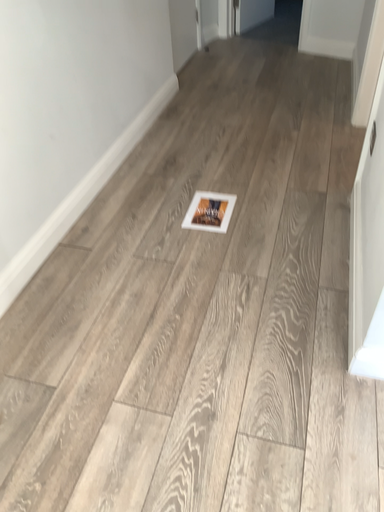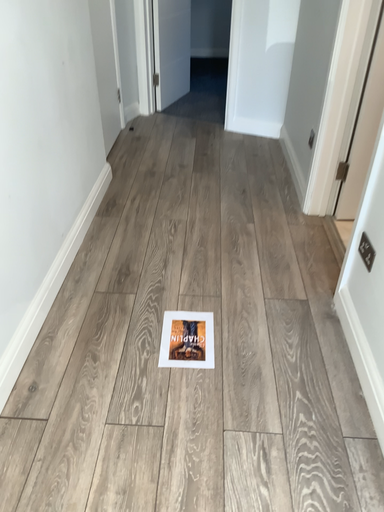
Question: How did the camera likely rotate when shooting the video?

Choices:
 (A) rotated downward
 (B) rotated upward

Answer: (B)